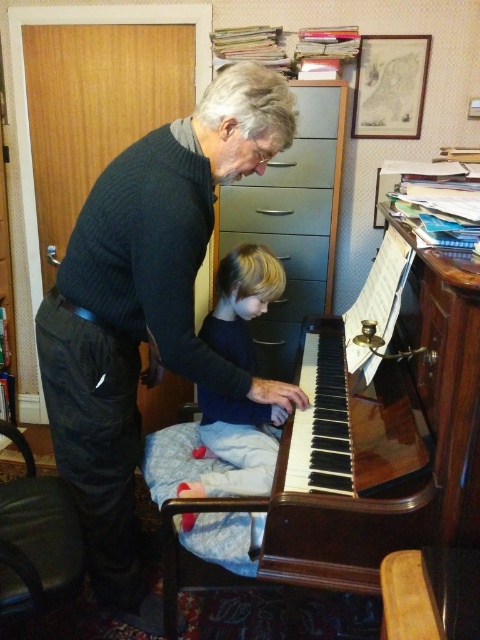
Does mahogany polished piano at center have a lesser height compared to metallic gray drawer at center?

In fact, mahogany polished piano at center may be taller than metallic gray drawer at center.

Is point (395, 451) closer to viewer compared to point (321, 150)?

Yes, point (395, 451) is closer to viewer.

This screenshot has width=480, height=640. In order to click on mahogany polished piano at center in this screenshot , I will do `click(344, 474)`.

Identify the location of mahogany polished piano at center. (344, 474).

Based on the photo, who is positioned more to the right, dark gray sweater at center or matte gray drawer at center?

matte gray drawer at center is more to the right.

The image size is (480, 640). I want to click on dark gray sweater at center, so click(x=146, y=310).

Which is more to the right, mahogany polished piano at center or dark blue sweater at center?

mahogany polished piano at center is more to the right.

Who is more distant from viewer, [340,532] or [252,465]?

Point [252,465]

This screenshot has height=640, width=480. I want to click on mahogany polished piano at center, so click(344, 474).